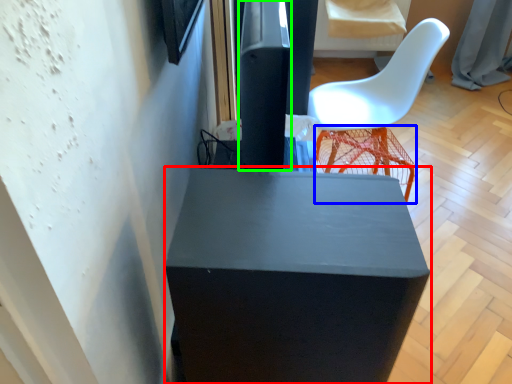
Question: Which is nearer to the furniture (highlighted by a red box)? bar stool (highlighted by a blue box) or pillar (highlighted by a green box).

Choices:
 (A) bar stool
 (B) pillar

Answer: (B)